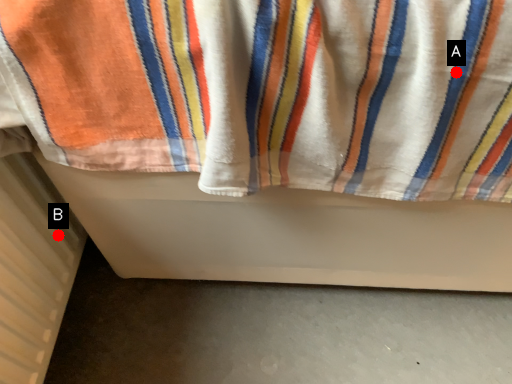
Question: Two points are circled on the image, labeled by A and B beside each circle. Among these points, which one is farthest from the camera?

Choices:
 (A) A is further
 (B) B is further

Answer: (B)